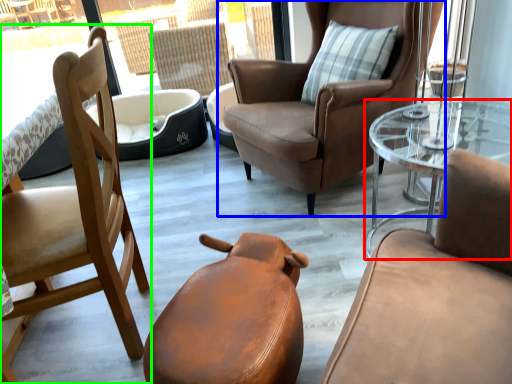
Question: Considering the real-world distances, which object is farthest from coffee table (highlighted by a red box)? chair (highlighted by a blue box) or chair (highlighted by a green box)?

Choices:
 (A) chair
 (B) chair

Answer: (B)